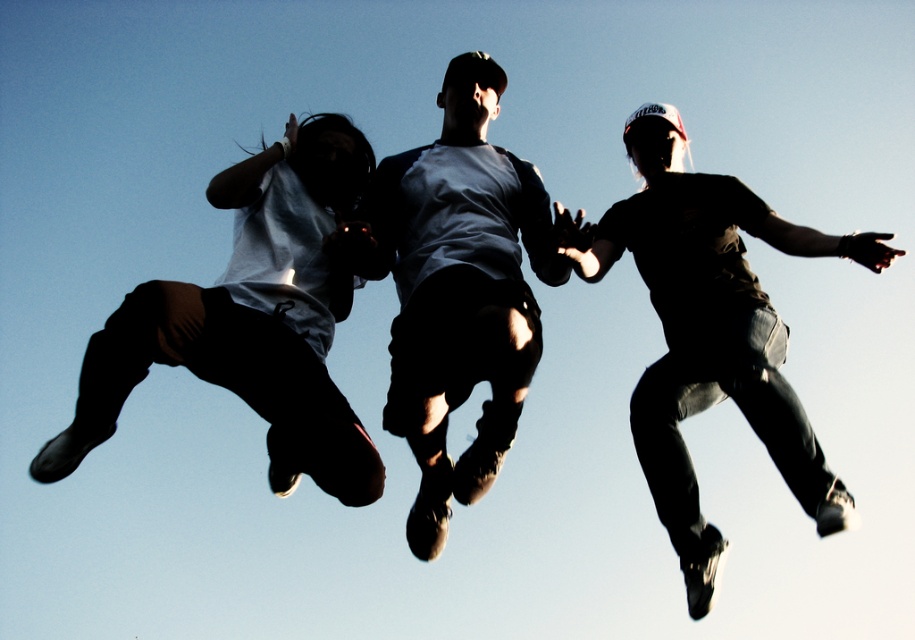
Question: Can you confirm if matte blue shirt at center is positioned to the left of dark gray jeans at center?

Choices:
 (A) yes
 (B) no

Answer: (A)

Question: Which is nearer to the matte blue shirt at center?

Choices:
 (A) dark gray jeans at center
 (B) matte black pants at left

Answer: (B)

Question: Can you confirm if matte blue shirt at center is wider than dark gray jeans at center?

Choices:
 (A) yes
 (B) no

Answer: (B)

Question: Which object appears closest to the camera in this image?

Choices:
 (A) dark gray jeans at center
 (B) matte blue shirt at center
 (C) matte black pants at left

Answer: (A)

Question: Is matte blue shirt at center positioned before dark gray jeans at center?

Choices:
 (A) no
 (B) yes

Answer: (A)

Question: Which object is farther from the camera taking this photo?

Choices:
 (A) matte blue shirt at center
 (B) dark gray jeans at center

Answer: (A)